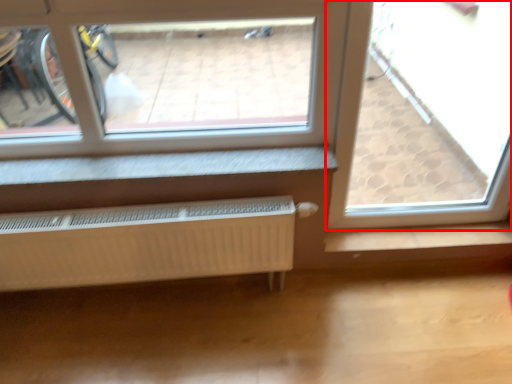
Question: From the image, what is the correct spatial relationship of window (annotated by the red box) in relation to radiator?

Choices:
 (A) right
 (B) left

Answer: (A)